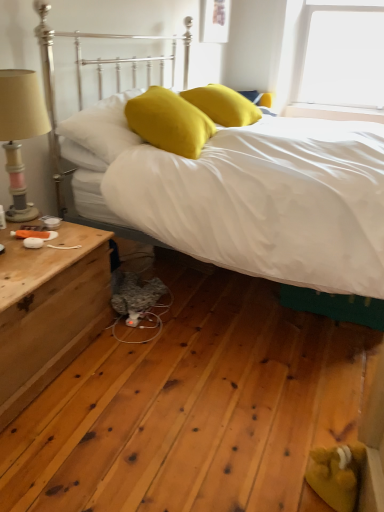
Question: Can you confirm if matte yellow pillow at center, the first pillow positioned from the right, is positioned to the right of wooden beige lampshade at left?

Choices:
 (A) yes
 (B) no

Answer: (A)

Question: Would you say matte yellow pillow at center, which ranks as the third pillow in left-to-right order, is outside wooden beige lampshade at left?

Choices:
 (A) no
 (B) yes

Answer: (B)

Question: Can you confirm if matte yellow pillow at center, the first pillow positioned from the right, is thinner than wooden beige lampshade at left?

Choices:
 (A) yes
 (B) no

Answer: (B)

Question: From a real-world perspective, does matte yellow pillow at center, the first pillow positioned from the right, sit lower than wooden beige lampshade at left?

Choices:
 (A) no
 (B) yes

Answer: (A)

Question: From the image's perspective, would you say matte yellow pillow at center, the first pillow positioned from the right, is shown under wooden beige lampshade at left?

Choices:
 (A) yes
 (B) no

Answer: (B)

Question: From the image's perspective, is white matte bed at center above or below yellow fabric pillow at center, the 2th pillow when ordered from left to right?

Choices:
 (A) below
 (B) above

Answer: (A)

Question: From their relative heights in the image, would you say white matte bed at center is taller or shorter than yellow fabric pillow at center, the second pillow viewed from the right?

Choices:
 (A) tall
 (B) short

Answer: (A)

Question: From a real-world perspective, is white matte bed at center above or below yellow fabric pillow at center, the second pillow viewed from the right?

Choices:
 (A) above
 (B) below

Answer: (B)

Question: Would you say white matte bed at center is to the left or to the right of yellow fabric pillow at center, the second pillow viewed from the right, in the picture?

Choices:
 (A) right
 (B) left

Answer: (A)

Question: In terms of height, does yellow fabric pillow at center, the 2th pillow when ordered from left to right, look taller or shorter compared to matte yellow pillow at center, the first pillow positioned from the right?

Choices:
 (A) tall
 (B) short

Answer: (A)

Question: Visually, is yellow fabric pillow at center, the second pillow viewed from the right, positioned to the left or to the right of matte yellow pillow at center, which ranks as the third pillow in left-to-right order?

Choices:
 (A) left
 (B) right

Answer: (A)

Question: From the image's perspective, is yellow fabric pillow at center, the 2th pillow when ordered from left to right, located above or below matte yellow pillow at center, which ranks as the third pillow in left-to-right order?

Choices:
 (A) below
 (B) above

Answer: (A)

Question: Would you say yellow fabric pillow at center, the second pillow viewed from the right, is inside or outside matte yellow pillow at center, the first pillow positioned from the right?

Choices:
 (A) outside
 (B) inside

Answer: (A)

Question: In terms of width, does wooden nightstand at left look wider or thinner when compared to yellow matte pillow at upper left, marked as the 1th pillow in a left-to-right arrangement?

Choices:
 (A) thin
 (B) wide

Answer: (B)

Question: From a real-world perspective, is wooden nightstand at left positioned above or below yellow matte pillow at upper left, which is counted as the 3th pillow, starting from the right?

Choices:
 (A) below
 (B) above

Answer: (A)